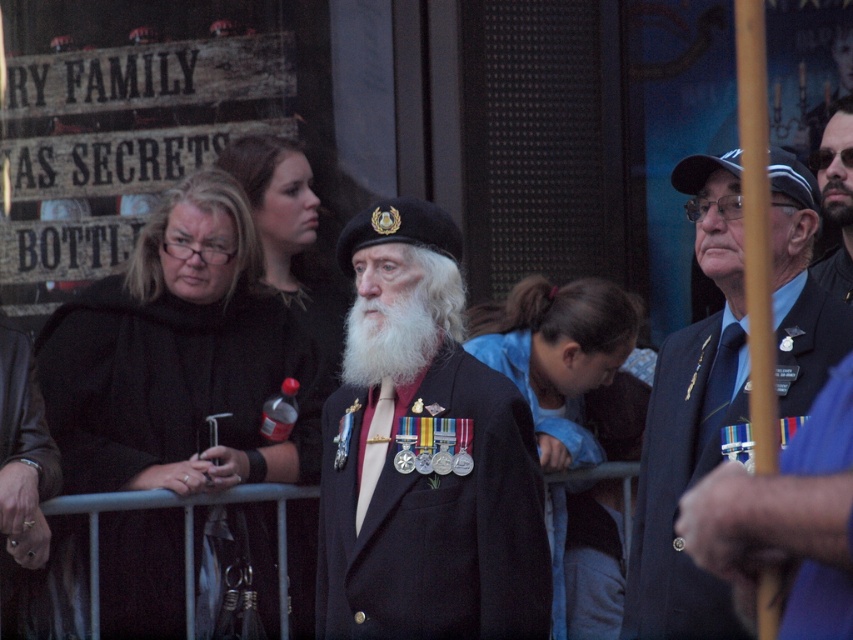
Question: Which point is closer to the camera?

Choices:
 (A) (846, 216)
 (B) (804, 403)
 (C) (55, 369)

Answer: (B)

Question: Is black matte coat at center behind shiny black suit at center?

Choices:
 (A) no
 (B) yes

Answer: (B)

Question: Can you confirm if black matte coat at center is positioned to the left of bearded man at center?

Choices:
 (A) no
 (B) yes

Answer: (B)

Question: Among these points, which one is nearest to the camera?

Choices:
 (A) (457, 444)
 (B) (804, 196)
 (C) (360, 296)
 (D) (828, 276)

Answer: (A)

Question: Which object is positioned closest to the shiny black suit at center?

Choices:
 (A) white matte beard at center
 (B) black matte coat at center

Answer: (A)

Question: Considering the relative positions of black matte coat at center and bearded man at center in the image provided, where is black matte coat at center located with respect to bearded man at center?

Choices:
 (A) right
 (B) left

Answer: (B)